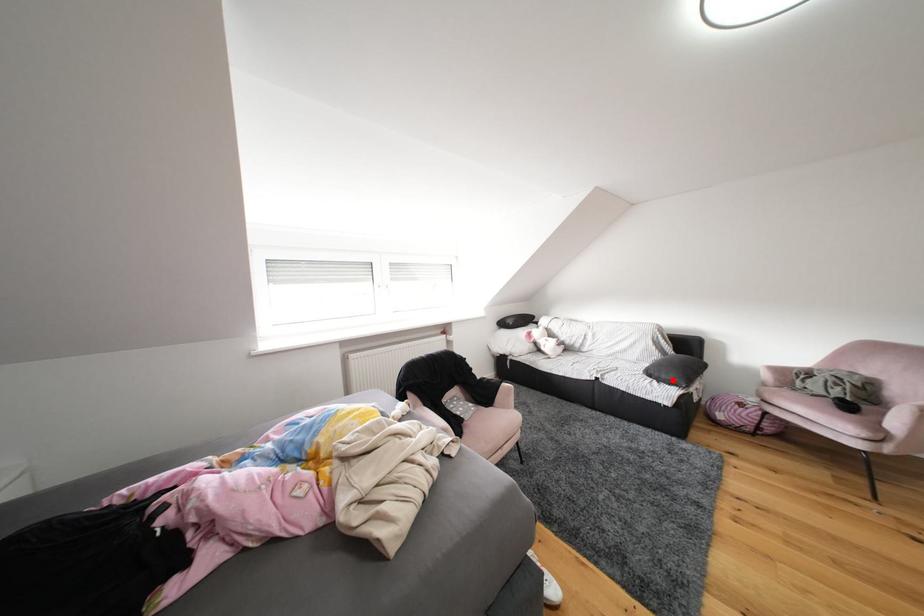
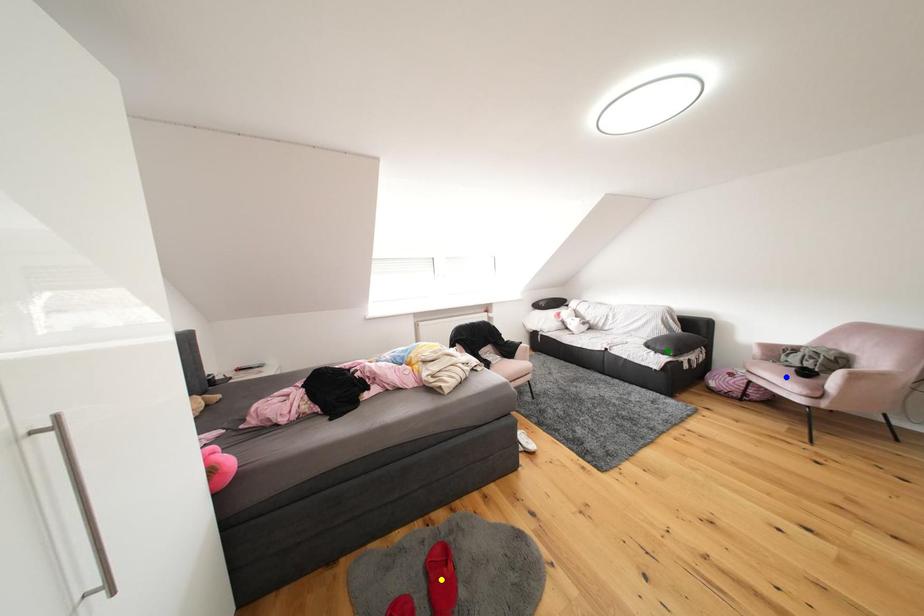
Question: I am providing you with two images of the same scene from different viewpoints. A red point is marked on the first image. You are given multiple points on the second image. Which mark in image 2 goes with the point in image 1?

Choices:
 (A) yellow point
 (B) green point
 (C) blue point

Answer: (B)